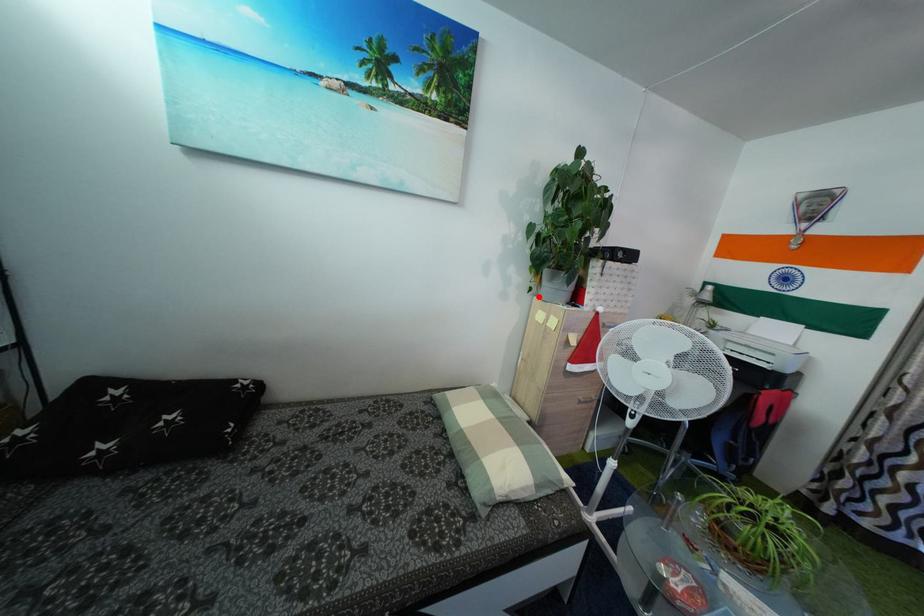
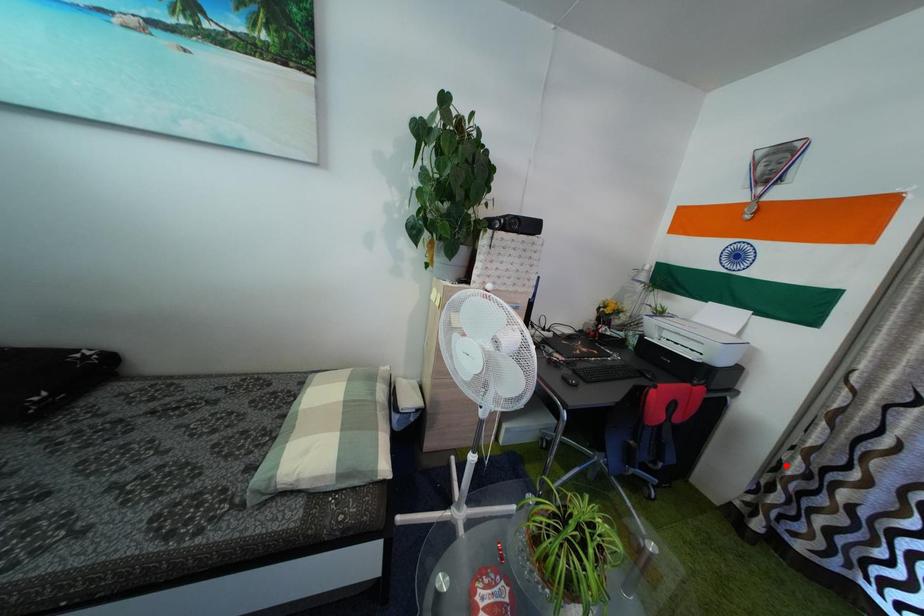
I am providing you with two images of the same scene from different viewpoints. A red point is marked on the first image and another point is marked on the second image. Is the red point in image1 aligned with the point shown in image2?

No